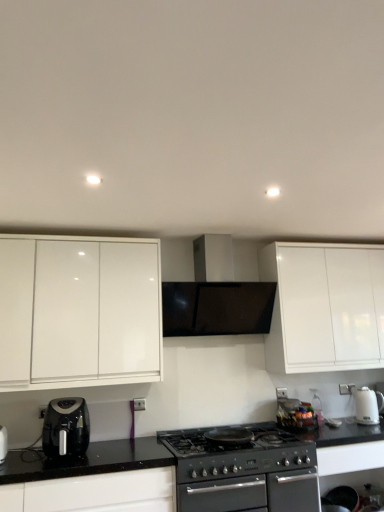
Locate an element on the screen. Image resolution: width=384 pixels, height=512 pixels. free space underneath white glossy electric kettle at right, the second kitchen appliance viewed from the front (from a real-world perspective) is located at coordinates (x=367, y=422).